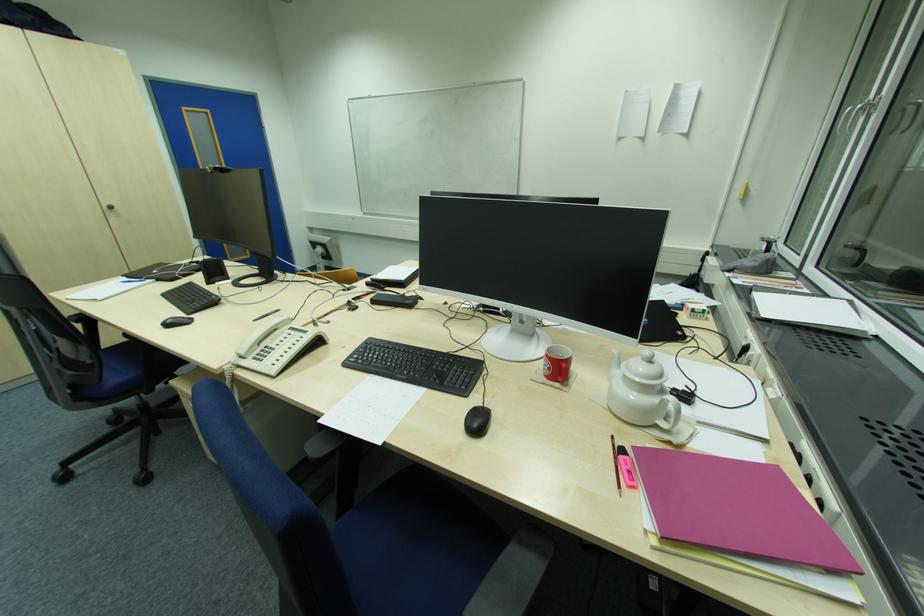
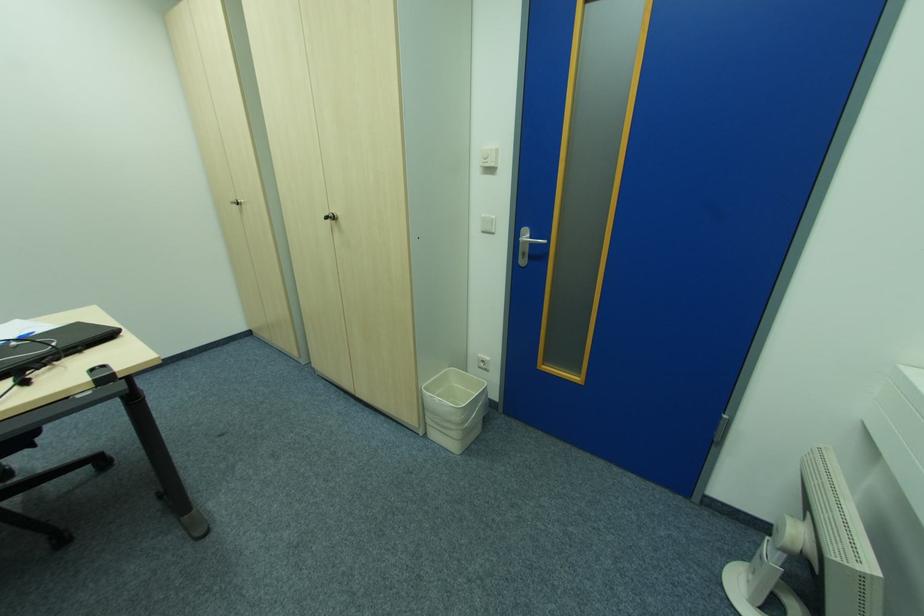
Locate, in the second image, the point that corresponds to [114,209] in the first image.

(334, 219)